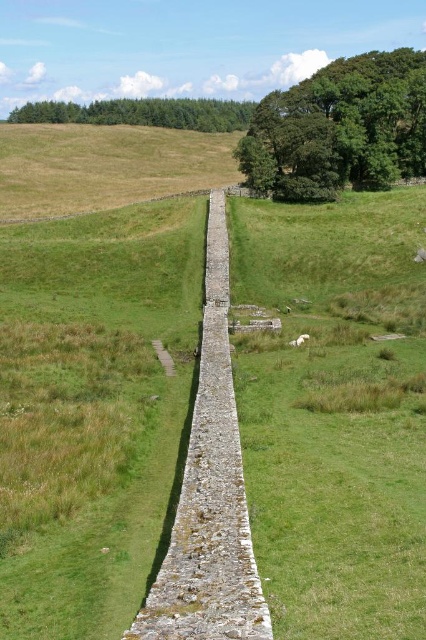
You are a hiker who wants to take a photo of the gray stone wall at center and the green textured trees at upper center. Which object will appear larger in the photo?

The green textured trees at upper center will appear larger in the photo because they are taller than the gray stone wall at center.